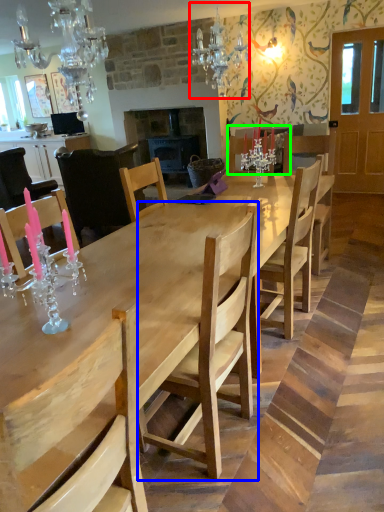
Question: Which is farther away from light fixture (highlighted by a red box)? chair (highlighted by a blue box) or chair (highlighted by a green box)?

Choices:
 (A) chair
 (B) chair

Answer: (A)